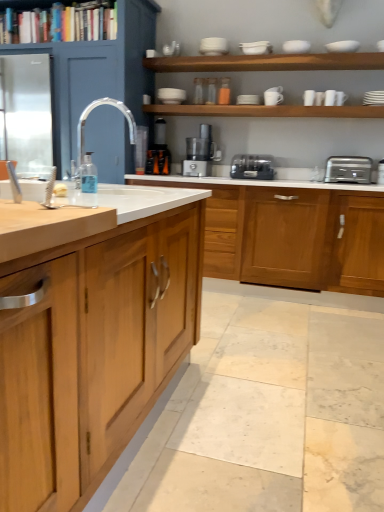
Describe the element at coordinates (93, 349) in the screenshot. This screenshot has width=384, height=512. I see `white marble countertop at center` at that location.

The image size is (384, 512). In order to click on white matte bowl at upper right, which appears as the 3th tableware when viewed from the right in this screenshot , I will do `click(343, 46)`.

Identify the location of satin silver toaster at center. The image size is (384, 512). (252, 167).

I want to click on white matte plate at upper center, arranged as the 9th tableware when viewed from the right, so click(248, 99).

What do you see at coordinates (248, 99) in the screenshot? Image resolution: width=384 pixels, height=512 pixels. I see `white matte plate at upper center, arranged as the 9th tableware when viewed from the right` at bounding box center [248, 99].

What do you see at coordinates (348, 170) in the screenshot? I see `silver metallic toaster at right` at bounding box center [348, 170].

The height and width of the screenshot is (512, 384). What do you see at coordinates (267, 62) in the screenshot?
I see `wooden shelf at upper center, the 2th shelf when ordered from top to bottom` at bounding box center [267, 62].

Find the location of `white marble countertop at center`. white marble countertop at center is located at coordinates (93, 349).

Where is `the 5th tableware to the right of the stainless steel refrigerator at left, starting your count from the anchor`? This screenshot has height=512, width=384. the 5th tableware to the right of the stainless steel refrigerator at left, starting your count from the anchor is located at coordinates (272, 98).

Between white glossy mug at upper center, which is the fifth tableware from left to right, and stainless steel refrigerator at left, which one is positioned behind?

white glossy mug at upper center, which is the fifth tableware from left to right, is further from the camera.

Which point is more forward, (273, 101) or (20, 77)?

The point (273, 101) is more forward.

How much distance is there between white glossy mug at upper center, which is the seventh tableware in right-to-left order, and stainless steel refrigerator at left?

white glossy mug at upper center, which is the seventh tableware in right-to-left order, is 1.92 meters away from stainless steel refrigerator at left.

From the image's perspective, relative to wooden shelf at upper center, which appears as the second shelf when ordered from the bottom, is white marble countertop at center above or below?

white marble countertop at center is situated lower than wooden shelf at upper center, which appears as the second shelf when ordered from the bottom, in the image.

How many degrees apart are the facing directions of white marble countertop at center and wooden shelf at upper center, the 2th shelf when ordered from top to bottom?

90.2 degrees.

In terms of size, does white marble countertop at center appear bigger or smaller than wooden shelf at upper center, which appears as the second shelf when ordered from the bottom?

In the image, white marble countertop at center appears to be larger than wooden shelf at upper center, which appears as the second shelf when ordered from the bottom.

Which point is more forward, (2, 472) or (170, 70)?

The point (2, 472) is closer to the camera.

Is stainless steel refrigerator at left turned away from white matte bowl at upper center, the 2th tableware viewed from the left?

That's not correct — stainless steel refrigerator at left is not looking away from white matte bowl at upper center, the 2th tableware viewed from the left.

Is stainless steel refrigerator at left taller or shorter than white matte bowl at upper center, the tenth tableware viewed from the right?

Clearly, stainless steel refrigerator at left is taller compared to white matte bowl at upper center, the tenth tableware viewed from the right.

From the image's perspective, between stainless steel refrigerator at left and white matte bowl at upper center, the 2th tableware viewed from the left, which one is located above?

white matte bowl at upper center, the 2th tableware viewed from the left, is shown above in the image.

How many degrees apart are the facing directions of stainless steel refrigerator at left and white matte bowl at upper center, the 2th tableware viewed from the left?

They differ by 2.7 degrees in their facing directions.

In order to click on the 2nd shelf to the right when counting from the wooden cabinet at left in this screenshot , I will do [267, 62].

From a real-world perspective, is wooden cabinet at left below wooden shelf at upper center, the 2th shelf when ordered from top to bottom?

Correct, in the physical world, wooden cabinet at left is lower than wooden shelf at upper center, the 2th shelf when ordered from top to bottom.

Looking at this image, considering the positions of objects wooden cabinet at left and wooden shelf at upper center, which appears as the second shelf when ordered from the bottom, in the image provided, who is behind, wooden cabinet at left or wooden shelf at upper center, which appears as the second shelf when ordered from the bottom,?

wooden shelf at upper center, which appears as the second shelf when ordered from the bottom, is more distant.

Can you confirm if wooden cabinet at left is thinner than wooden shelf at upper center, which appears as the second shelf when ordered from the bottom?

Incorrect, the width of wooden cabinet at left is not less than that of wooden shelf at upper center, which appears as the second shelf when ordered from the bottom.

From the image's perspective, is white marble countertop at center located above or below white matte bowl at upper center, which is counted as the 6th tableware, starting from the left?

Clearly, from the image's perspective, white marble countertop at center is below white matte bowl at upper center, which is counted as the 6th tableware, starting from the left.

Considering the positions of objects white marble countertop at center and white matte bowl at upper center, which is counted as the 6th tableware, starting from the left, in the image provided, who is in front, white marble countertop at center or white matte bowl at upper center, which is counted as the 6th tableware, starting from the left,?

Positioned in front is white marble countertop at center.

In the scene shown: Can you see white marble countertop at center touching white matte bowl at upper center, which is counted as the 6th tableware, starting from the left?

No, white marble countertop at center is not beside white matte bowl at upper center, which is counted as the 6th tableware, starting from the left.

In the scene shown: Which is more distant, (65, 476) or (299, 42)?

The point (299, 42) is more distant.

Considering the positions of objects white matte bowl at upper center, which is counted as the 6th tableware, starting from the left, and translucent plastic blender at center in the image provided, who is more to the left, white matte bowl at upper center, which is counted as the 6th tableware, starting from the left, or translucent plastic blender at center?

translucent plastic blender at center is more to the left.

Could you tell me if white matte bowl at upper center, which is counted as the 6th tableware, starting from the left, is facing translucent plastic blender at center?

No, white matte bowl at upper center, which is counted as the 6th tableware, starting from the left, is not turned towards translucent plastic blender at center.

From a real-world perspective, between white matte bowl at upper center, which is counted as the 6th tableware, starting from the left, and translucent plastic blender at center, who is vertically higher?

white matte bowl at upper center, which is counted as the 6th tableware, starting from the left.

Considering the positions of point (296, 44) and point (151, 151), is point (296, 44) closer or farther from the camera than point (151, 151)?

Clearly, point (296, 44) is closer to the camera than point (151, 151).

The height and width of the screenshot is (512, 384). What are the coordinates of `tableware that is the 1st one when counting rightward from the white glossy bowls at upper center, acting as the eighth tableware starting from the right` in the screenshot? It's located at (272, 98).

Could you measure the distance between white glossy mug at upper center, which is the fifth tableware from left to right, and white glossy bowls at upper center, which ranks as the 4th tableware in left-to-right order?

white glossy mug at upper center, which is the fifth tableware from left to right, and white glossy bowls at upper center, which ranks as the 4th tableware in left-to-right order, are 14.39 inches apart from each other.

Is the position of white glossy mug at upper center, which is the seventh tableware in right-to-left order, less distant than that of white glossy bowls at upper center, which ranks as the 4th tableware in left-to-right order?

No, white glossy mug at upper center, which is the seventh tableware in right-to-left order, is further to the viewer.

Can we say white glossy mug at upper center, which is the seventh tableware in right-to-left order, lies outside white glossy bowls at upper center, acting as the eighth tableware starting from the right?

Absolutely, white glossy mug at upper center, which is the seventh tableware in right-to-left order, is external to white glossy bowls at upper center, acting as the eighth tableware starting from the right.

Locate an element on the screen. This screenshot has width=384, height=512. glass door located below the white glossy mug at upper center, which is the seventh tableware in right-to-left order (from the image's perspective) is located at coordinates (27, 114).

Identify the location of countertop that is in front of the wooden shelf at upper center, the 2th shelf when ordered from top to bottom. The width and height of the screenshot is (384, 512). (93, 349).

Looking at the image, which one is located closer to white glossy bowls at upper center, which ranks as the 4th tableware in left-to-right order, white matte bowl at upper right, which appears as the 3th tableware when viewed from the right, or white ceramic mug at upper center, the 2th tableware positioned from the right?

white matte bowl at upper right, which appears as the 3th tableware when viewed from the right.

Based on their spatial positions, is white matte bowl at upper center, the 2th tableware viewed from the left, or yellow butter at left closer to white marble countertop at center?

The object closer to white marble countertop at center is yellow butter at left.

Consider the image. Based on their spatial positions, is white ceramic cup at upper center, the fifth tableware in the right-to-left sequence, or wooden shelf at upper center, which appears as the second shelf when ordered from the bottom, further from wooden cabinet at left?

white ceramic cup at upper center, the fifth tableware in the right-to-left sequence, is further to wooden cabinet at left.

Estimate the real-world distances between objects in this image. Which object is further from satin silver toaster at center, white matte bowl at upper center, which is counted as the 6th tableware, starting from the left, or white glossy mug at upper center, which is the fifth tableware from left to right?

Among the two, white matte bowl at upper center, which is counted as the 6th tableware, starting from the left, is located further to satin silver toaster at center.

Considering their positions, is white glossy cup at upper right, the fourth tableware viewed from the right, positioned closer to satin silver food processor at center than white ceramic cup at upper center, the fifth tableware in the right-to-left sequence?

white ceramic cup at upper center, the fifth tableware in the right-to-left sequence, is closer to satin silver food processor at center.

From the picture: When comparing their distances from white glossy mug at upper center, which is the fifth tableware from left to right, does white glossy cup at upper right, positioned as the 8th tableware in left-to-right order, or white matte bowl at upper center, the 6th tableware positioned from the right, seem further?

white matte bowl at upper center, the 6th tableware positioned from the right.

Estimate the real-world distances between objects in this image. Which object is further from silver metallic toaster at right, white matte bowl at upper center, the 6th tableware positioned from the right, or white matte bowl at upper right, which appears as the ninth tableware when viewed from the left?

white matte bowl at upper center, the 6th tableware positioned from the right, lies further to silver metallic toaster at right than the other object.

Based on the photo, estimate the real-world distances between objects in this image. Which object is closer to wooden bookshelf at upper left, the first shelf from the top, white matte plate at upper right, which appears as the eleventh tableware when viewed from the left, or white glossy mug at upper center, which is the seventh tableware in right-to-left order?

white glossy mug at upper center, which is the seventh tableware in right-to-left order, lies closer to wooden bookshelf at upper left, the first shelf from the top, than the other object.

The image size is (384, 512). I want to click on kitchen appliance between white marble countertop at center and white matte bowl at upper center, marked as the eleventh tableware in a right-to-left arrangement, from front to back, so click(348, 170).

What are the coordinates of `toaster located between white matte plate at upper center, arranged as the 9th tableware when viewed from the right, and white ceramic mug at upper center, which is counted as the tenth tableware, starting from the left, in the left-right direction` in the screenshot? It's located at coord(252,167).

You are a GUI agent. You are given a task and a screenshot of the screen. Output one action in this format:
    pyautogui.click(x=<x>, y=<y>)
    Task: Click on the appliance between stainless steel refrigerator at left and white ceramic mug at upper center, which is counted as the tenth tableware, starting from the left, in the horizontal direction
    
    Given the screenshot: What is the action you would take?
    pyautogui.click(x=159, y=151)

Locate an element on the screen. bottle situated between yellow butter at left and silver metallic toaster at right from left to right is located at coordinates (88, 175).